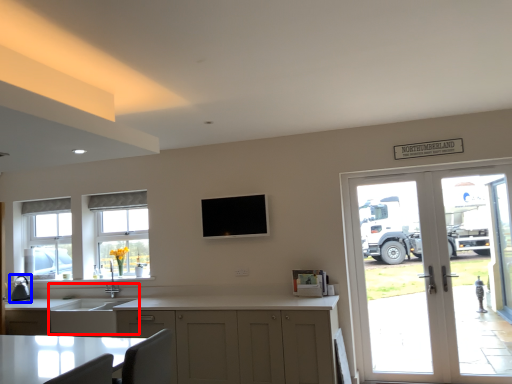
Question: Which object is closer to the camera taking this photo, sink (highlighted by a red box) or appliance (highlighted by a blue box)?

Choices:
 (A) sink
 (B) appliance

Answer: (A)